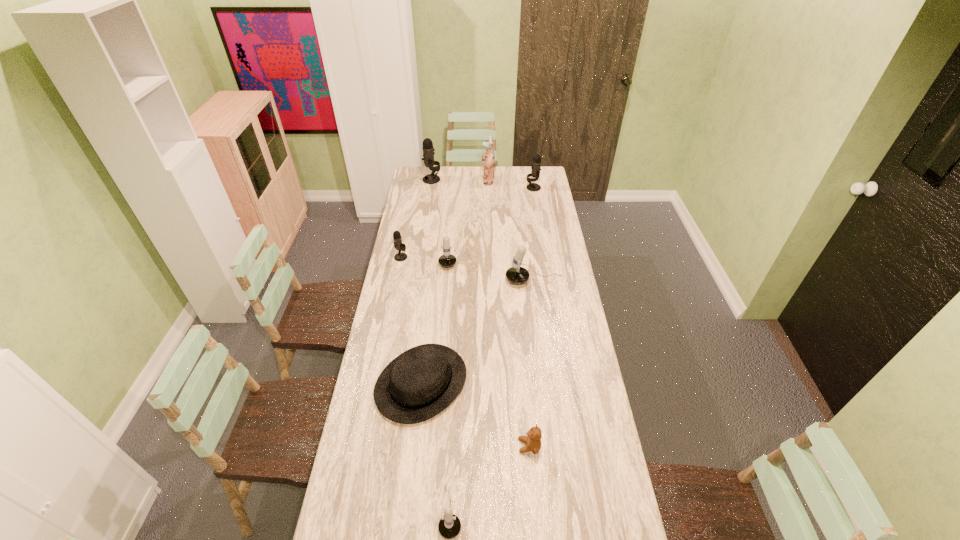
I want to click on teddy bear, so click(533, 440).

What are the coordinates of `the seventh farthest object` in the screenshot? It's located at (420, 383).

Image resolution: width=960 pixels, height=540 pixels. In order to click on black fedora in this screenshot , I will do `click(420, 383)`.

The height and width of the screenshot is (540, 960). In order to click on vacant space located on the front-facing side of the pink figurine in this screenshot , I will do tap(433, 180).

Where is `vacant space positioned 0.320m on the front-facing side of the pink figurine`? This screenshot has height=540, width=960. vacant space positioned 0.320m on the front-facing side of the pink figurine is located at coordinates (429, 180).

Image resolution: width=960 pixels, height=540 pixels. Identify the location of vacant region located 0.320m on the front-facing side of the pink figurine. (429, 180).

This screenshot has width=960, height=540. I want to click on vacant area situated 0.060m on the left of the biggest black microphone, so click(x=413, y=179).

Locate an element on the screen. The image size is (960, 540). blank space located 0.110m on the back of the second smallest black microphone is located at coordinates (531, 174).

Find the location of a particular element. Image resolution: width=960 pixels, height=540 pixels. vacant area situated 0.080m on the left of the rightmost white microphone is located at coordinates (488, 281).

The width and height of the screenshot is (960, 540). Find the location of `free spot located 0.090m on the back of the second smallest white microphone`. free spot located 0.090m on the back of the second smallest white microphone is located at coordinates (450, 232).